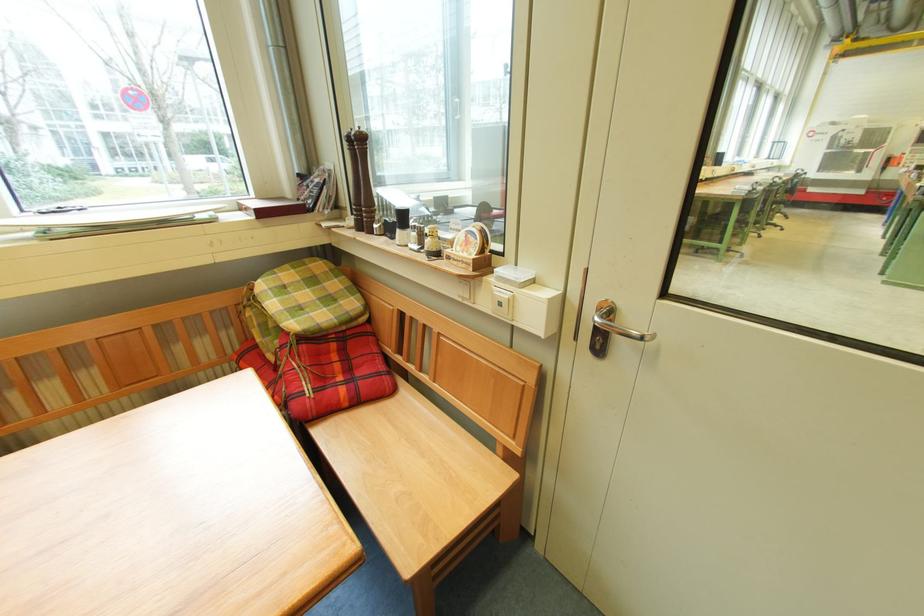
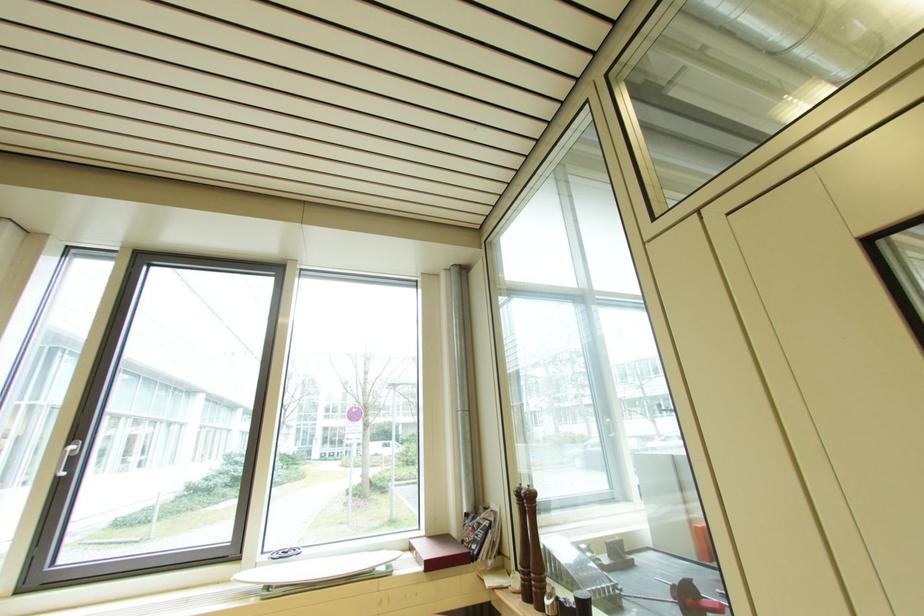
Find the pixel in the second image that matches (x=249, y=205) in the first image.

(420, 545)